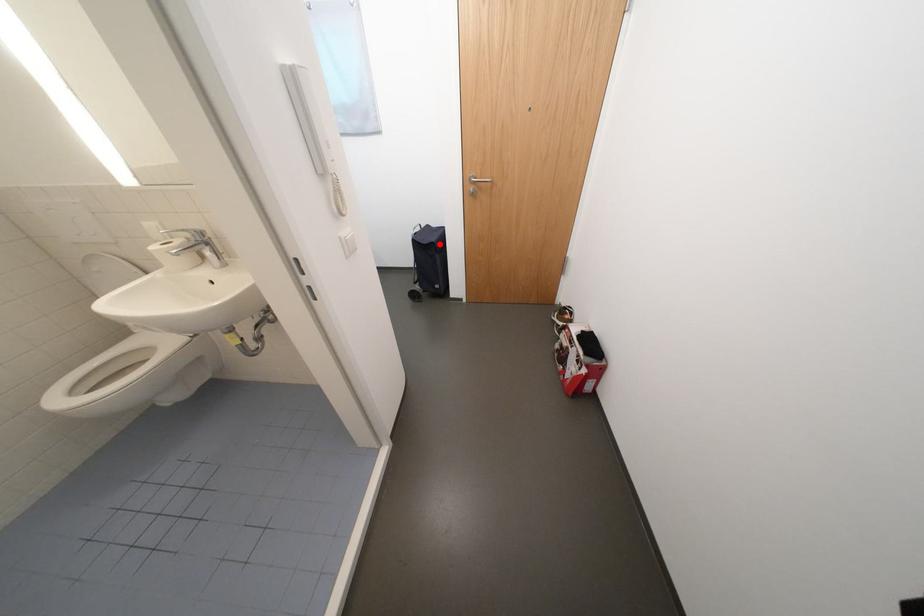
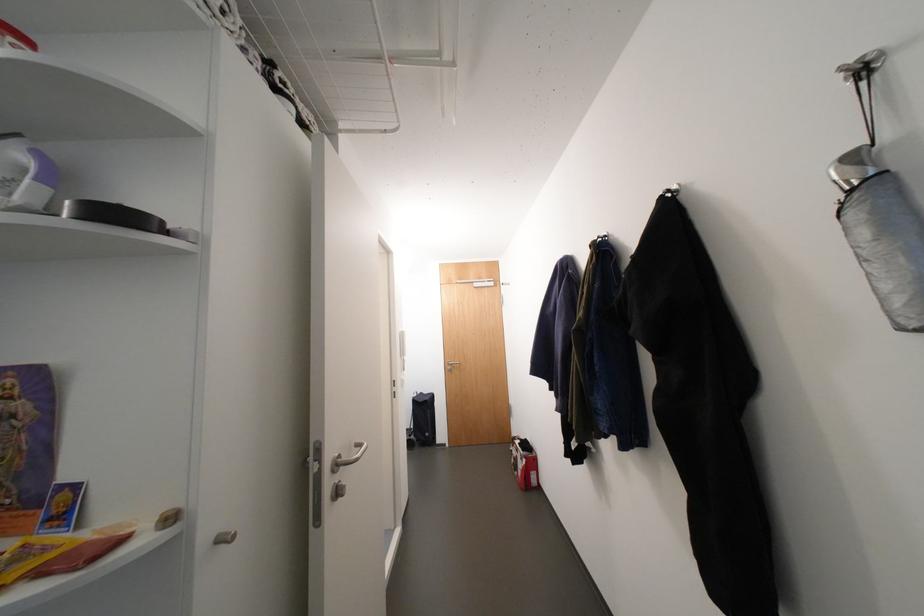
Find the pixel in the second image that matches the highlighted location in the first image.

(433, 402)